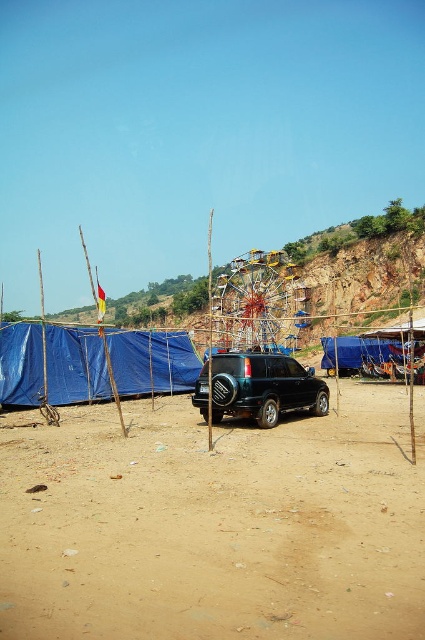
Question: Which object is the closest to the metallic yellow ferris wheel at center?

Choices:
 (A) blue tarpaulin tent at left
 (B) brown sandy ground at center

Answer: (A)

Question: Which point appears closest to the camera in this image?

Choices:
 (A) (x=90, y=328)
 (B) (x=243, y=376)
 (C) (x=252, y=298)

Answer: (B)

Question: Among these objects, which one is farthest from the camera?

Choices:
 (A) brown sandy ground at center
 (B) metallic yellow ferris wheel at center
 (C) satin black suv at center
 (D) blue tarpaulin tent at left

Answer: (B)

Question: Can you confirm if brown sandy ground at center is positioned to the right of blue tarpaulin tent at left?

Choices:
 (A) yes
 (B) no

Answer: (A)

Question: Observing the image, what is the correct spatial positioning of satin black suv at center in reference to metallic yellow ferris wheel at center?

Choices:
 (A) below
 (B) above

Answer: (A)

Question: Can you confirm if blue tarpaulin tent at left is positioned to the right of metallic yellow ferris wheel at center?

Choices:
 (A) yes
 (B) no

Answer: (B)